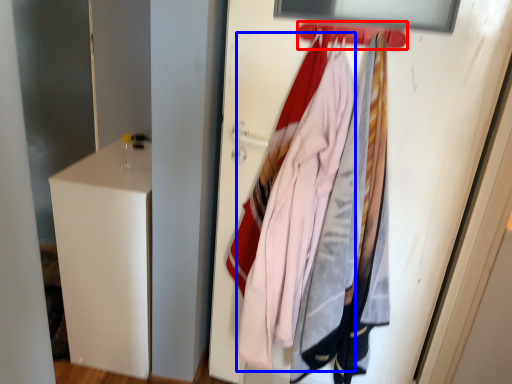
Question: Which of the following is the farthest to the observer, hanger (highlighted by a red box) or clothing (highlighted by a blue box)?

Choices:
 (A) hanger
 (B) clothing

Answer: (B)